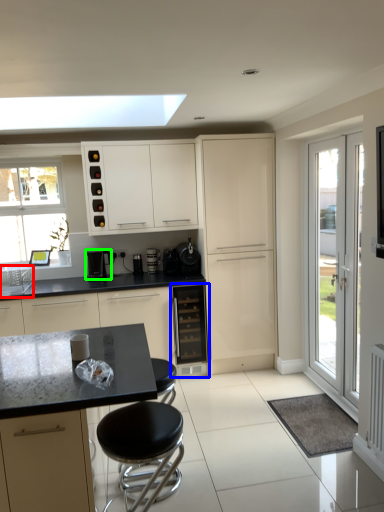
Question: Which object is the farthest from sink (highlighted by a red box)? Choose among these: oven (highlighted by a blue box) or kitchen appliance (highlighted by a green box).

Choices:
 (A) oven
 (B) kitchen appliance

Answer: (A)